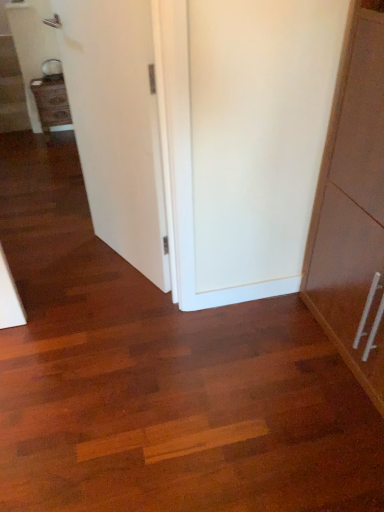
Where is `free spot to the left of white smooth door at center`? The image size is (384, 512). free spot to the left of white smooth door at center is located at coordinates (69, 254).